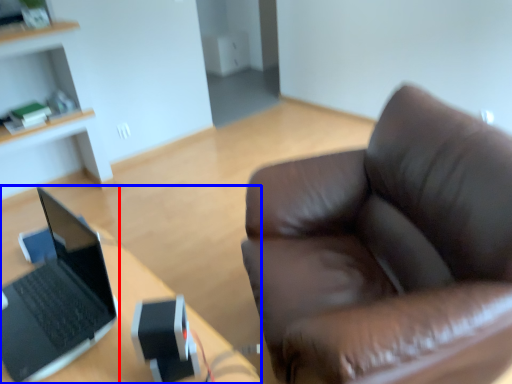
Question: Among these objects, which one is nearest to the camera, laptop (highlighted by a red box) or desk (highlighted by a blue box)?

Choices:
 (A) laptop
 (B) desk

Answer: (B)